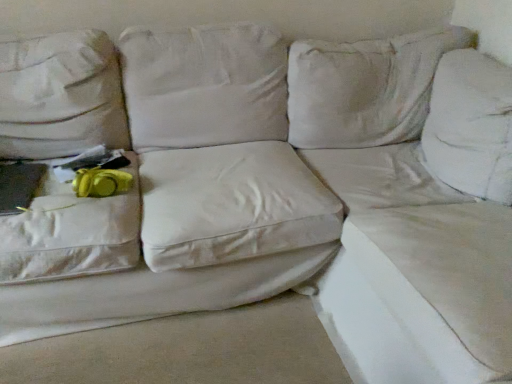
Question: Is white fabric sheet at lower right, which is the second sheet from right to left, completely or partially inside white fabric couch at upper right, positioned as the 2th sheet in left-to-right order?

Choices:
 (A) no
 (B) yes

Answer: (A)

Question: From the image's perspective, is white fabric couch at upper right, positioned as the 2th sheet in left-to-right order, over white fabric sheet at lower right, which is the second sheet from right to left?

Choices:
 (A) yes
 (B) no

Answer: (A)

Question: Can you confirm if white fabric couch at upper right, acting as the first sheet starting from the right, is wider than white fabric sheet at lower right, which is counted as the first sheet, starting from the left?

Choices:
 (A) yes
 (B) no

Answer: (B)

Question: Is white fabric couch at upper right, acting as the first sheet starting from the right, behind white fabric sheet at lower right, which is the second sheet from right to left?

Choices:
 (A) yes
 (B) no

Answer: (B)

Question: From the image's perspective, is white fabric couch at upper right, acting as the first sheet starting from the right, under white fabric sheet at lower right, which is the second sheet from right to left?

Choices:
 (A) yes
 (B) no

Answer: (B)

Question: In terms of width, does yellow fabric at left look wider or thinner when compared to white fabric sheet at lower right, which is counted as the first sheet, starting from the left?

Choices:
 (A) wide
 (B) thin

Answer: (B)

Question: Relative to white fabric sheet at lower right, which is counted as the first sheet, starting from the left, is yellow fabric at left in front or behind?

Choices:
 (A) behind
 (B) front

Answer: (A)

Question: Is yellow fabric at left inside or outside of white fabric sheet at lower right, which is the second sheet from right to left?

Choices:
 (A) outside
 (B) inside

Answer: (A)

Question: Is yellow fabric at left taller or shorter than white fabric sheet at lower right, which is the second sheet from right to left?

Choices:
 (A) tall
 (B) short

Answer: (B)

Question: Looking at their shapes, would you say white fabric couch at upper right, positioned as the 2th sheet in left-to-right order, is wider or thinner than yellow fabric at left?

Choices:
 (A) thin
 (B) wide

Answer: (B)

Question: Is white fabric couch at upper right, acting as the first sheet starting from the right, in front of or behind yellow fabric at left in the image?

Choices:
 (A) front
 (B) behind

Answer: (A)

Question: Considering the positions of white fabric couch at upper right, positioned as the 2th sheet in left-to-right order, and yellow fabric at left in the image, is white fabric couch at upper right, positioned as the 2th sheet in left-to-right order, taller or shorter than yellow fabric at left?

Choices:
 (A) short
 (B) tall

Answer: (B)

Question: Do you think white fabric couch at upper right, acting as the first sheet starting from the right, is within yellow fabric at left, or outside of it?

Choices:
 (A) outside
 (B) inside

Answer: (A)

Question: Based on their sizes in the image, would you say white fabric couch at upper right, acting as the first sheet starting from the right, is bigger or smaller than white fabric sheet at lower right, which is counted as the first sheet, starting from the left?

Choices:
 (A) big
 (B) small

Answer: (A)

Question: Is white fabric couch at upper right, acting as the first sheet starting from the right, to the left or to the right of white fabric sheet at lower right, which is counted as the first sheet, starting from the left, in the image?

Choices:
 (A) left
 (B) right

Answer: (B)